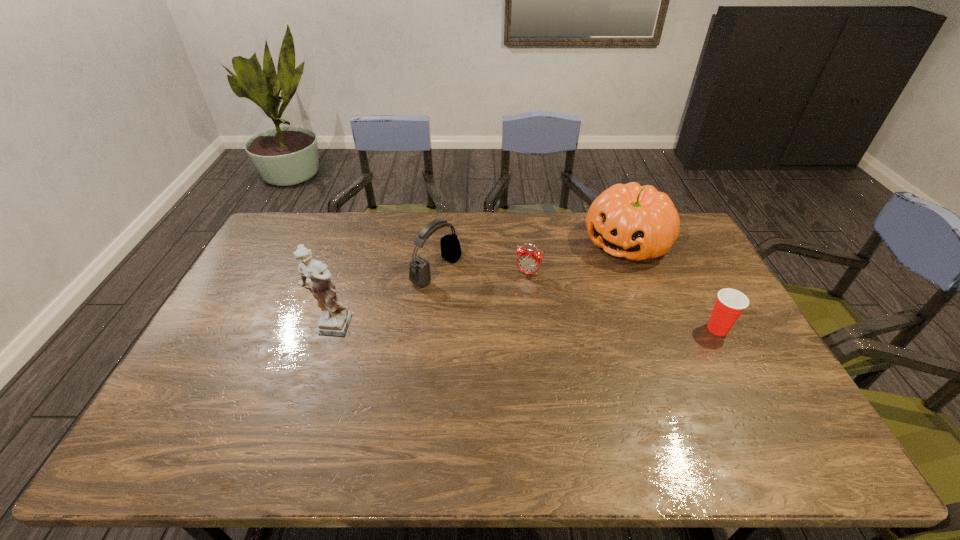
Where is `empty location between the Dixie cup and the headset`? This screenshot has width=960, height=540. empty location between the Dixie cup and the headset is located at coordinates (577, 300).

Locate an element on the screen. The image size is (960, 540). vacant space that is in between the figurine and the third object from right to left is located at coordinates (429, 301).

Identify the location of vacant area between the pumpkin and the Dixie cup. (672, 286).

Find the location of a particular element. Image resolution: width=960 pixels, height=540 pixels. unoccupied position between the leftmost object and the fourth object from right to left is located at coordinates (383, 300).

The image size is (960, 540). What are the coordinates of `the closest object to the pumpkin` in the screenshot? It's located at tap(529, 261).

Identify which object is the fourth closest to the leftmost object. Please provide its 2D coordinates. Your answer should be formatted as a tuple, i.e. [(x, y)], where the tuple contains the x and y coordinates of a point satisfying the conditions above.

[(730, 303)]

You are a GUI agent. You are given a task and a screenshot of the screen. Output one action in this format:
    pyautogui.click(x=<x>, y=<y>)
    Task: Click on the vacant space that satisfies the following two spatial constraints: 1. on the front side of the third object from right to left; 2. on the right side of the headset
    The height and width of the screenshot is (540, 960).
    Given the screenshot: What is the action you would take?
    tap(436, 274)

This screenshot has height=540, width=960. I want to click on free point that satisfies the following two spatial constraints: 1. on the back side of the alarm clock; 2. on the left side of the pumpkin, so click(x=524, y=242).

At what (x,y) coordinates should I click in order to perform the action: click on vacant space that satisfies the following two spatial constraints: 1. on the back side of the fourth object from right to left; 2. on the right side of the pumpkin. Please return your answer as a coordinate pair (x, y). This screenshot has height=540, width=960. Looking at the image, I should click on (440, 242).

Locate an element on the screen. Image resolution: width=960 pixels, height=540 pixels. vacant space that satisfies the following two spatial constraints: 1. on the front side of the second object from left to right; 2. on the left side of the Dixie cup is located at coordinates (430, 328).